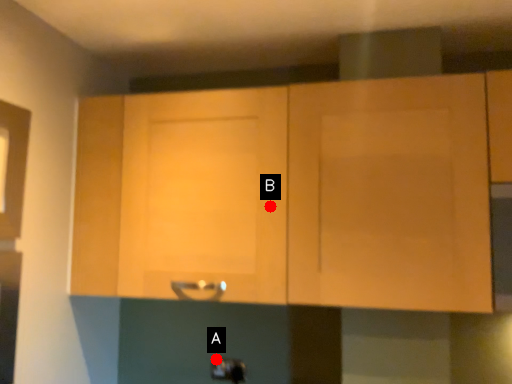
Question: Two points are circled on the image, labeled by A and B beside each circle. Which of the following is the closest to the observer?

Choices:
 (A) A is closer
 (B) B is closer

Answer: (B)